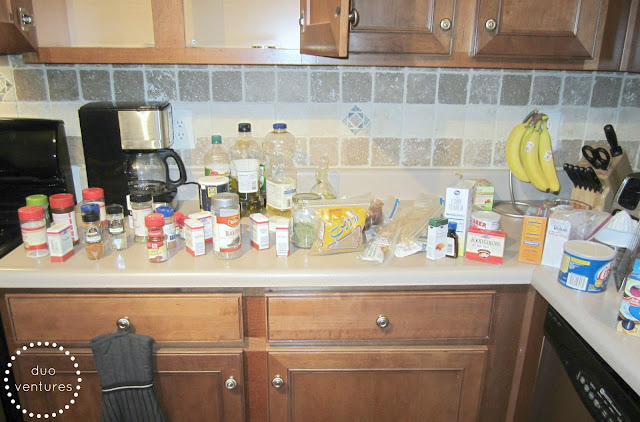
The height and width of the screenshot is (422, 640). What are the coordinates of `cabinet` in the screenshot? It's located at (155, 40), (291, 53), (465, 54), (575, 58).